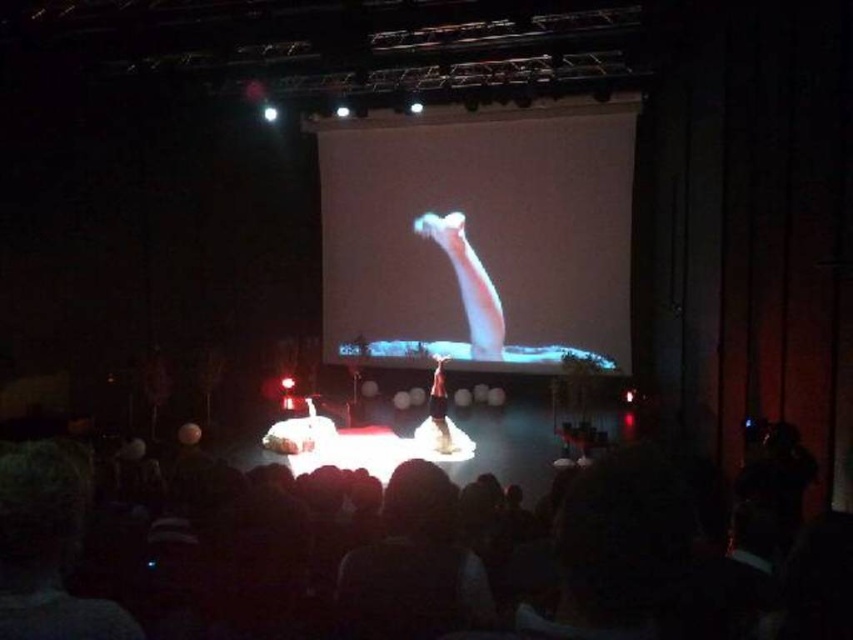
Can you confirm if translucent white figure at center is positioned to the left of white fabric at center?

In fact, translucent white figure at center is to the right of white fabric at center.

Does translucent white figure at center appear over white fabric at center?

Correct, translucent white figure at center is located above white fabric at center.

Measure the distance between translucent white figure at center and camera.

Answer: translucent white figure at center and camera are 12.96 meters apart from each other.

The image size is (853, 640). I want to click on translucent white figure at center, so click(468, 282).

Does black fabric crowd at lower center come in front of white matte projection screen at center?

Yes, it is in front of white matte projection screen at center.

Is black fabric crowd at lower center to the right of white matte projection screen at center from the viewer's perspective?

No, black fabric crowd at lower center is not to the right of white matte projection screen at center.

Locate an element on the screen. The image size is (853, 640). black fabric crowd at lower center is located at coordinates (589, 566).

Measure the distance between point (x=397, y=188) and camera.

Point (x=397, y=188) is 44.45 feet from camera.

From the picture: Is white matte projection screen at center closer to the viewer compared to black hair at center?

No, it is not.

Identify the location of white matte projection screen at center. (479, 234).

The width and height of the screenshot is (853, 640). Identify the location of white matte projection screen at center. (479, 234).